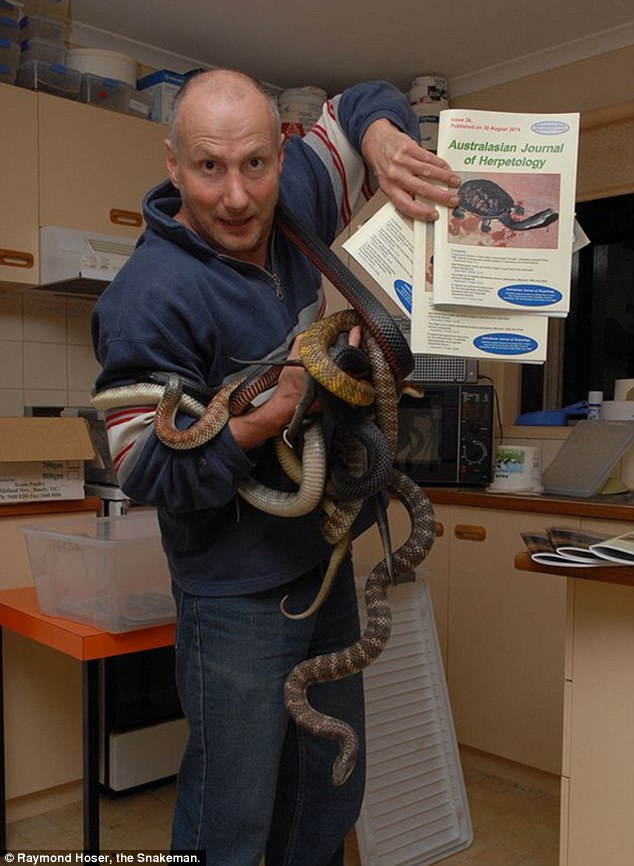
I want to click on cabinets, so click(x=18, y=207), click(x=101, y=203), click(x=432, y=574), click(x=520, y=684), click(x=596, y=688), click(x=8, y=569).